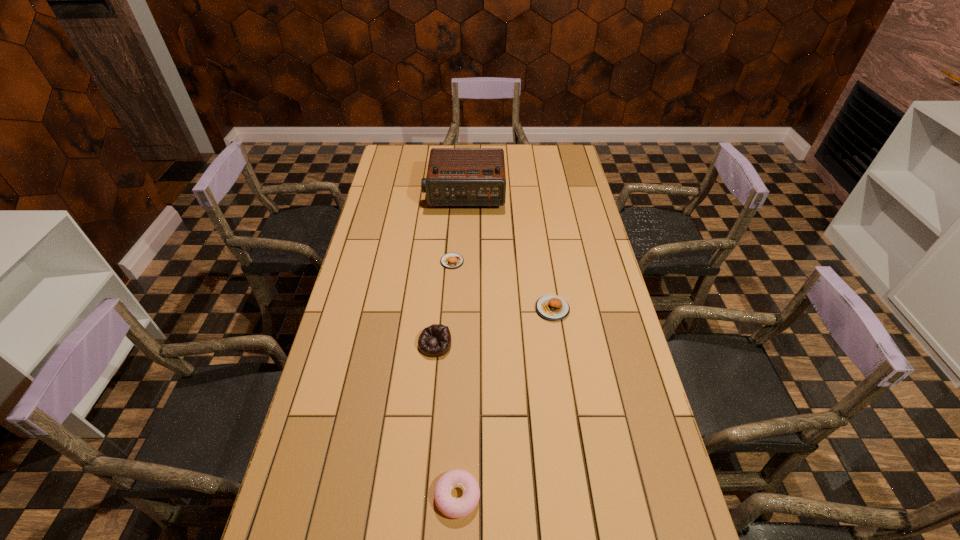
Find the location of a particular element. Image resolution: width=960 pixels, height=540 pixels. empty space between the rightmost object and the farthest object is located at coordinates (509, 252).

Image resolution: width=960 pixels, height=540 pixels. What are the coordinates of `vacant region between the fourth farthest object and the farthest object` in the screenshot? It's located at (449, 269).

The image size is (960, 540). Identify the location of free spot between the radio receiver and the right food. (509, 252).

You are a GUI agent. You are given a task and a screenshot of the screen. Output one action in this format:
    pyautogui.click(x=<x>, y=<y>)
    Task: Click on the free space between the tallest object and the right food
    The width and height of the screenshot is (960, 540).
    Given the screenshot: What is the action you would take?
    pyautogui.click(x=509, y=252)

This screenshot has width=960, height=540. I want to click on unoccupied area between the nearest object and the farthest object, so coord(461,345).

At what (x,y) coordinates should I click in order to perform the action: click on vacant space in between the doughnut and the farther food. Please return your answer as a coordinate pair (x, y). The width and height of the screenshot is (960, 540). Looking at the image, I should click on (455, 379).

The width and height of the screenshot is (960, 540). I want to click on free space between the beanbag and the left food, so click(444, 303).

Select which object is the fourth closest to the farther food. Please provide its 2D coordinates. Your answer should be formatted as a tuple, i.e. [(x, y)], where the tuple contains the x and y coordinates of a point satisfying the conditions above.

[(458, 508)]

In order to click on object that is the third closest to the tallest object in this screenshot , I will do `click(434, 341)`.

Find the location of a particular element. This screenshot has width=960, height=540. vacant space that satisfies the following two spatial constraints: 1. on the front side of the left food; 2. on the left side of the rightmost object is located at coordinates (449, 309).